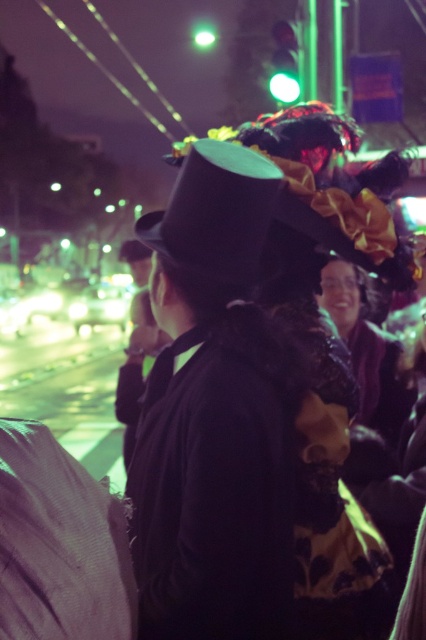
You are standing in the middle of the street during the nighttime festival. You notice the matte black hat at center. Can you determine its exact position using the coordinate system provided?

The matte black hat at center is located at point (213, 416) in the coordinate system.

You are a photographer trying to capture a clear shot of both the matte black hat at center and the matte black jacket at center in the scene. Given that your camera has a minimum focus distance of 5 feet, will you be able to focus on both objects simultaneously?

The matte black hat at center and the matte black jacket at center are 8.37 feet apart from each other. Since the minimum focus distance required is 5 feet, the photographer can focus on both objects simultaneously because the distance between them is greater than the minimum focus requirement.

You are a photographer trying to capture the sparkly purple dress at center in the best possible way. Given that the dress is located at coordinates point 0.547, 0.864, where should you position your camera to ensure it is centered in the frame?

To center the sparkly purple dress at center, position the camera so the dress aligns with the frame center at coordinates point (368, 349).